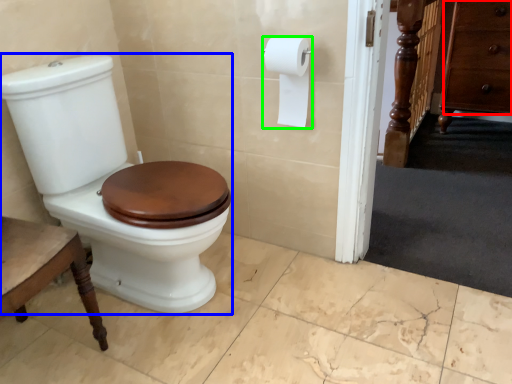
Question: Which object is the farthest from drawer (highlighted by a red box)? Choose among these: porcelain (highlighted by a blue box) or toilet paper (highlighted by a green box).

Choices:
 (A) porcelain
 (B) toilet paper

Answer: (A)